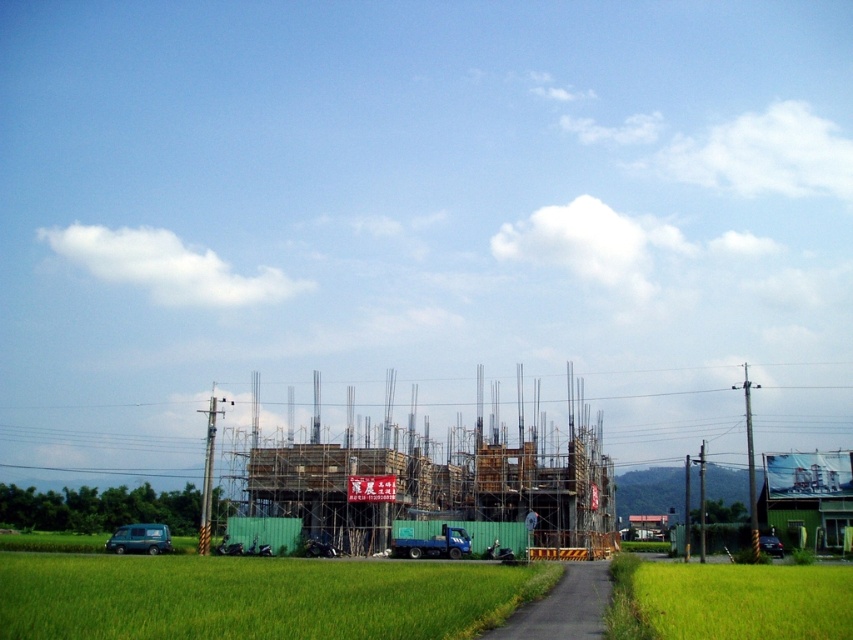
Looking at this image, measure the distance from green grass at lower left to green grass at lower right.

green grass at lower left is 16.37 meters from green grass at lower right.

Does green grass at lower left have a lesser height compared to green grass at lower right?

No, green grass at lower left is not shorter than green grass at lower right.

Find the location of a particular element. This screenshot has width=853, height=640. green grass at lower left is located at coordinates (256, 596).

Is point (236, 557) farther from viewer compared to point (401, 509)?

No, (236, 557) is in front of (401, 509).

Is green grass at lower left shorter than wooden scaffolding at center?

Correct, green grass at lower left is not as tall as wooden scaffolding at center.

Which is behind, point (439, 577) or point (560, 465)?

Positioned behind is point (560, 465).

In order to click on green grass at lower left in this screenshot , I will do pyautogui.click(x=256, y=596).

Who is shorter, wooden scaffolding at center or green grass at lower right?

With less height is green grass at lower right.

The height and width of the screenshot is (640, 853). Describe the element at coordinates (438, 490) in the screenshot. I see `wooden scaffolding at center` at that location.

I want to click on wooden scaffolding at center, so tap(438, 490).